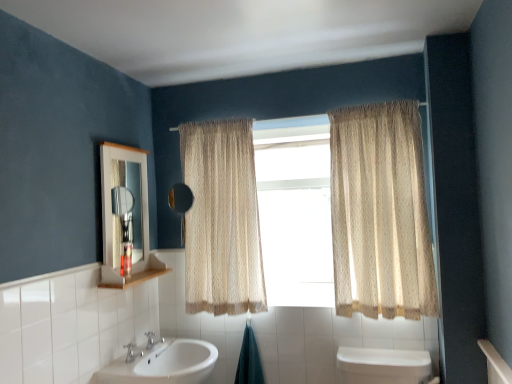
This screenshot has width=512, height=384. Identify the location of teal fabric towel at lower center. (249, 360).

Looking at this image, measure the distance between black matte mirror at center and camera.

black matte mirror at center and camera are 7.77 feet apart.

The image size is (512, 384). Describe the element at coordinates (181, 204) in the screenshot. I see `black matte mirror at center` at that location.

What is the approximate height of beige textured curtain at right, acting as the first curtain starting from the right?

It is 1.09 meters.

The height and width of the screenshot is (384, 512). What do you see at coordinates (59, 149) in the screenshot?
I see `white tile at left` at bounding box center [59, 149].

Measure the distance between beige sheer curtain at center, the first curtain from the left, and camera.

7.52 feet.

The height and width of the screenshot is (384, 512). What do you see at coordinates (222, 219) in the screenshot?
I see `beige sheer curtain at center, the 2th curtain from the right` at bounding box center [222, 219].

At what (x,y) coordinates should I click in order to perform the action: click on silver metallic faucet at lower center. Please return your answer as a coordinate pair (x, y). The image size is (512, 384). Looking at the image, I should click on (132, 352).

Is translucent fabric curtain at center oriented away from beige textured curtain at right, acting as the first curtain starting from the right?

No, beige textured curtain at right, acting as the first curtain starting from the right, is not at the back of translucent fabric curtain at center.

Who is bigger, translucent fabric curtain at center or beige textured curtain at right, placed as the 2th curtain when sorted from left to right?

beige textured curtain at right, placed as the 2th curtain when sorted from left to right, is bigger.

From a real-world perspective, which is physically above, translucent fabric curtain at center or beige textured curtain at right, placed as the 2th curtain when sorted from left to right?

In real-world perspective, beige textured curtain at right, placed as the 2th curtain when sorted from left to right, is above.

Can you confirm if teal fabric towel at lower center is smaller than silver metallic faucet at lower center?

No, teal fabric towel at lower center is not smaller than silver metallic faucet at lower center.

Is teal fabric towel at lower center inside or outside of silver metallic faucet at lower center?

teal fabric towel at lower center exists outside the volume of silver metallic faucet at lower center.

Is point (248, 372) farther from viewer compared to point (140, 353)?

Yes, point (248, 372) is behind point (140, 353).

Is beige sheer curtain at center, the 2th curtain from the right, in front of or behind white wood medicine cabinet at upper left in the image?

Visually, beige sheer curtain at center, the 2th curtain from the right, is located behind white wood medicine cabinet at upper left.

From the image's perspective, would you say beige sheer curtain at center, the 2th curtain from the right, is positioned over white wood medicine cabinet at upper left?

No, from the image's perspective, beige sheer curtain at center, the 2th curtain from the right, is not on top of white wood medicine cabinet at upper left.

From a real-world perspective, between beige sheer curtain at center, the 2th curtain from the right, and white wood medicine cabinet at upper left, who is vertically higher?

white wood medicine cabinet at upper left.

This screenshot has width=512, height=384. I want to click on medicine cabinet located on the left of beige sheer curtain at center, the first curtain from the left, so click(119, 217).

From the image's perspective, is white wood medicine cabinet at upper left below white tile at left?

Actually, white wood medicine cabinet at upper left appears above white tile at left in the image.

In the scene shown: Is white wood medicine cabinet at upper left at the right side of white tile at left?

Yes.

Is white wood medicine cabinet at upper left located outside white tile at left?

white wood medicine cabinet at upper left lies outside white tile at left's area.

From the image's perspective, relative to teal fabric towel at lower center, is beige textured curtain at right, acting as the first curtain starting from the right, above or below?

beige textured curtain at right, acting as the first curtain starting from the right, is above teal fabric towel at lower center.

Which of these two, beige textured curtain at right, placed as the 2th curtain when sorted from left to right, or teal fabric towel at lower center, is thinner?

With smaller width is teal fabric towel at lower center.

From the picture: Considering the relative sizes of beige textured curtain at right, placed as the 2th curtain when sorted from left to right, and teal fabric towel at lower center in the image provided, is beige textured curtain at right, placed as the 2th curtain when sorted from left to right, bigger than teal fabric towel at lower center?

Correct, beige textured curtain at right, placed as the 2th curtain when sorted from left to right, is larger in size than teal fabric towel at lower center.

Considering the sizes of objects translucent fabric curtain at center and white glossy sink at lower center in the image provided, who is bigger, translucent fabric curtain at center or white glossy sink at lower center?

white glossy sink at lower center is bigger.

Measure the distance from translucent fabric curtain at center to white glossy sink at lower center.

translucent fabric curtain at center is 33.82 inches from white glossy sink at lower center.

Considering the sizes of objects translucent fabric curtain at center and white glossy sink at lower center in the image provided, who is thinner, translucent fabric curtain at center or white glossy sink at lower center?

Thinner between the two is translucent fabric curtain at center.

Which is in front, translucent fabric curtain at center or white glossy sink at lower center?

Answer: white glossy sink at lower center is closer to the camera.

Does white tile at left have a lesser width compared to translucent fabric curtain at center?

Correct, the width of white tile at left is less than that of translucent fabric curtain at center.

Can you tell me how much white tile at left and translucent fabric curtain at center differ in facing direction?

The angular difference between white tile at left and translucent fabric curtain at center is 90.2 degrees.

Based on the photo, from a real-world perspective, is white tile at left physically below translucent fabric curtain at center?

Correct, in the physical world, white tile at left is lower than translucent fabric curtain at center.

Would you say white tile at left is to the left or to the right of translucent fabric curtain at center in the picture?

Based on their positions, white tile at left is located to the left of translucent fabric curtain at center.

At what (x,y) coordinates should I click in order to perform the action: click on window that is under the beige textured curtain at right, acting as the first curtain starting from the right (from a real-world perspective). Please return your answer as a coordinate pair (x, y). This screenshot has height=384, width=512. Looking at the image, I should click on (295, 210).

I want to click on plumbing fixture in front of the teal fabric towel at lower center, so click(132, 352).

When comparing their distances from white tile at left, does white wood medicine cabinet at upper left or black matte mirror at center seem closer?

white wood medicine cabinet at upper left is positioned closer to the anchor white tile at left.

Based on the photo, estimate the real-world distances between objects in this image. Which object is closer to white tile at left, teal fabric towel at lower center or translucent fabric curtain at center?

translucent fabric curtain at center is closer to white tile at left.

Looking at this image, considering their positions, is silver metallic faucet at lower center positioned closer to translucent fabric curtain at center than white glossy sink at lower center?

Based on the image, white glossy sink at lower center appears to be nearer to translucent fabric curtain at center.

From the image, which object appears to be nearer to translucent fabric curtain at center, white glossy sink at lower center or teal fabric towel at lower center?

teal fabric towel at lower center is closer to translucent fabric curtain at center.

Considering their positions, is translucent fabric curtain at center positioned further to teal fabric towel at lower center than beige sheer curtain at center, the first curtain from the left?

The object further to teal fabric towel at lower center is translucent fabric curtain at center.

Estimate the real-world distances between objects in this image. Which object is closer to white wood medicine cabinet at upper left, white tile at left or teal fabric towel at lower center?

The object closer to white wood medicine cabinet at upper left is white tile at left.

When comparing their distances from white wood medicine cabinet at upper left, does beige textured curtain at right, acting as the first curtain starting from the right, or silver metallic faucet at lower center seem further?

beige textured curtain at right, acting as the first curtain starting from the right, is positioned further to the anchor white wood medicine cabinet at upper left.

Which object lies further to the anchor point beige sheer curtain at center, the first curtain from the left, white wood medicine cabinet at upper left or white tile at left?

Based on the image, white tile at left appears to be further to beige sheer curtain at center, the first curtain from the left.

Locate an element on the screen. The image size is (512, 384). shower curtain between white tile at left and black matte mirror at center along the z-axis is located at coordinates (249, 360).

You are a GUI agent. You are given a task and a screenshot of the screen. Output one action in this format:
    pyautogui.click(x=<x>, y=<y>)
    Task: Click on the shower curtain positioned between white tile at left and translucent fabric curtain at center from near to far
    Image resolution: width=512 pixels, height=384 pixels.
    Given the screenshot: What is the action you would take?
    pyautogui.click(x=249, y=360)

The width and height of the screenshot is (512, 384). I want to click on shower curtain between white tile at left and beige textured curtain at right, placed as the 2th curtain when sorted from left to right, so click(249, 360).

You are a GUI agent. You are given a task and a screenshot of the screen. Output one action in this format:
    pyautogui.click(x=<x>, y=<y>)
    Task: Click on the curtain between white wood medicine cabinet at upper left and silver metallic faucet at lower center vertically
    This screenshot has height=384, width=512.
    Given the screenshot: What is the action you would take?
    pyautogui.click(x=222, y=219)